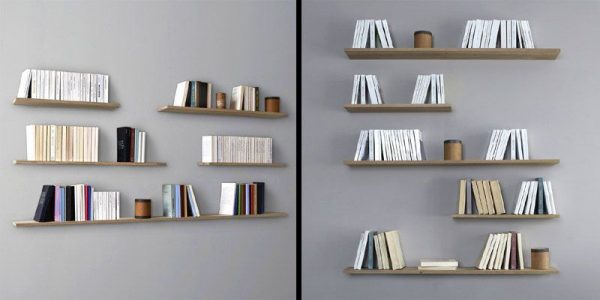
Identify the location of groups of books. Image resolution: width=600 pixels, height=300 pixels. (55, 77), (196, 92), (251, 95), (51, 138), (136, 149), (243, 148), (64, 200), (107, 203), (182, 203), (253, 203).